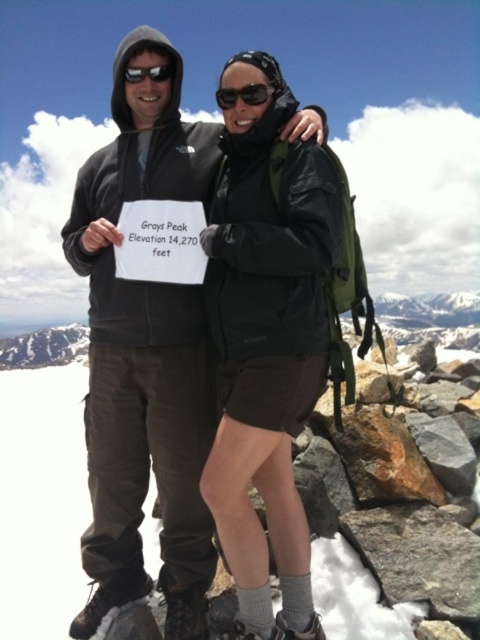
Question: Which object is closer to the camera taking this photo?

Choices:
 (A) black reflective sunglasses at upper center
 (B) matte black jacket at center
 (C) white powder snow at lower center

Answer: (B)

Question: Which object appears farthest from the camera in this image?

Choices:
 (A) matte black jacket at center
 (B) black reflective sunglasses at upper center

Answer: (B)

Question: Does matte black jacket at center come in front of white powder snow at lower center?

Choices:
 (A) no
 (B) yes

Answer: (B)

Question: Which of the following is the closest to the observer?

Choices:
 (A) matte black jacket at center
 (B) white powder snow at lower center
 (C) black plastic goggles at center
 (D) black reflective sunglasses at upper center

Answer: (A)

Question: From the image, what is the correct spatial relationship of matte black jacket at center in relation to black plastic goggles at center?

Choices:
 (A) below
 (B) above

Answer: (A)

Question: Is white powder snow at lower center below black plastic goggles at center?

Choices:
 (A) no
 (B) yes

Answer: (B)